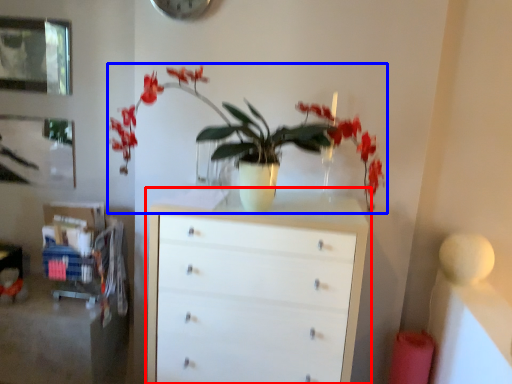
Question: Which object is closer to the camera taking this photo, chest of drawers (highlighted by a red box) or houseplant (highlighted by a blue box)?

Choices:
 (A) chest of drawers
 (B) houseplant

Answer: (B)